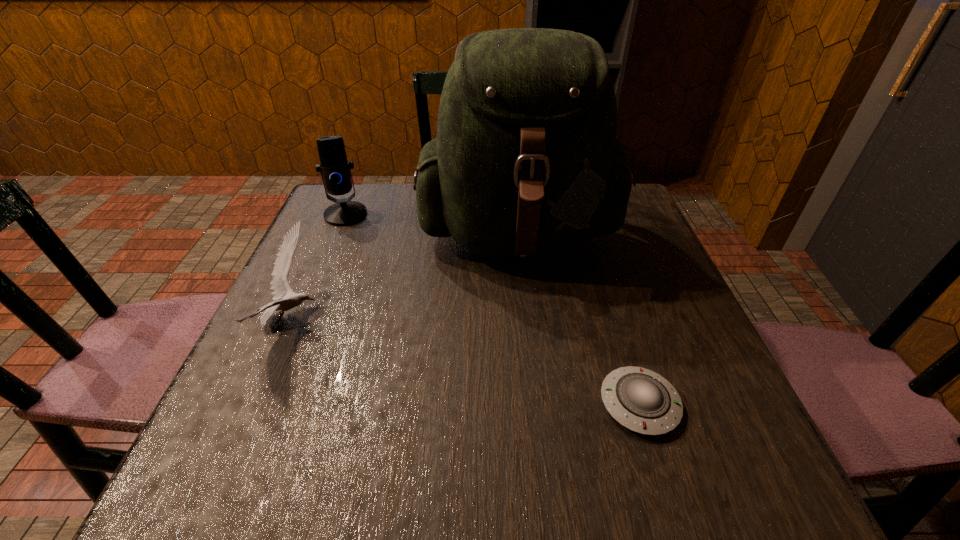
Locate which object ranks in proximity to the third tallest object. Please provide its 2D coordinates. Your answer should be formatted as a tuple, i.e. [(x, y)], where the tuple contains the x and y coordinates of a point satisfying the conditions above.

[(526, 161)]

I want to click on the second closest object relative to the shortest object, so click(280, 287).

This screenshot has width=960, height=540. I want to click on free spot that satisfies the following two spatial constraints: 1. at the tip of the beak of the gull; 2. on the left side of the saucer, so [x=255, y=404].

Find the location of a particular element. vacant area that satisfies the following two spatial constraints: 1. at the tip of the beak of the gull; 2. on the left side of the shortest object is located at coordinates (255, 404).

This screenshot has width=960, height=540. What are the coordinates of `free location that satisfies the following two spatial constraints: 1. on the stand of the third shortest object; 2. on the right side of the saucer` in the screenshot? It's located at (267, 404).

Locate an element on the screen. This screenshot has width=960, height=540. free point that satisfies the following two spatial constraints: 1. on the stand of the third shortest object; 2. at the tip of the beak of the gull is located at coordinates (301, 320).

I want to click on free space that satisfies the following two spatial constraints: 1. on the stand of the microphone; 2. on the right side of the shortest object, so point(267,404).

The height and width of the screenshot is (540, 960). Find the location of `vacant region that satisfies the following two spatial constraints: 1. on the stand of the microphone; 2. at the tip of the beak of the gull`. vacant region that satisfies the following two spatial constraints: 1. on the stand of the microphone; 2. at the tip of the beak of the gull is located at coordinates (301, 320).

Where is `blank area in the image that satisfies the following two spatial constraints: 1. on the stand of the third shortest object; 2. on the left side of the saucer`? This screenshot has height=540, width=960. blank area in the image that satisfies the following two spatial constraints: 1. on the stand of the third shortest object; 2. on the left side of the saucer is located at coordinates (267, 404).